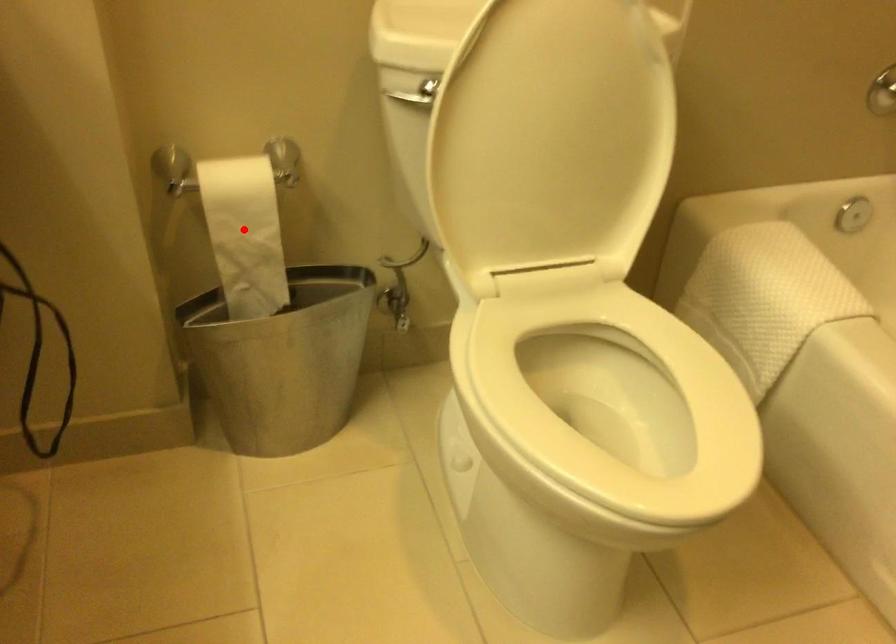
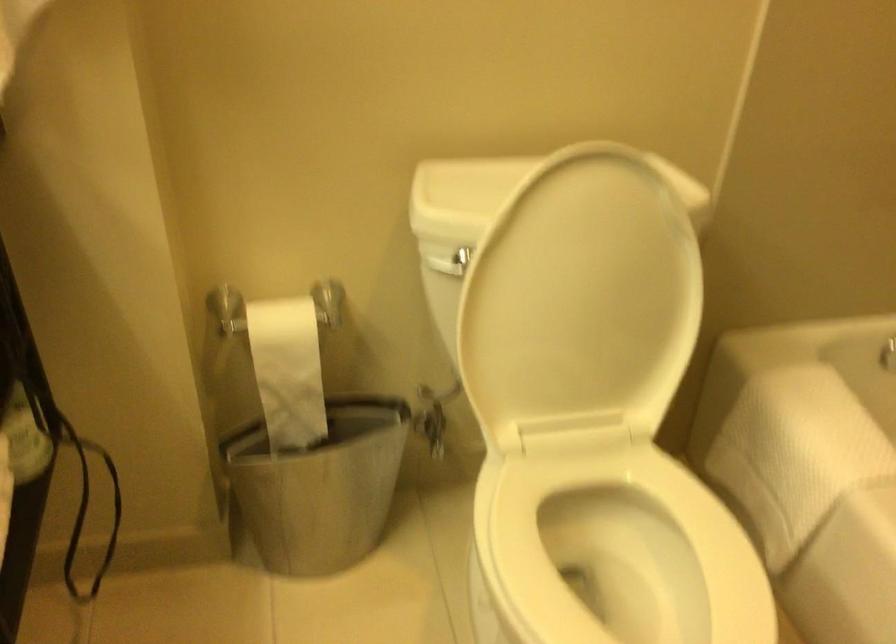
Find the pixel in the second image that matches the highlighted location in the first image.

(288, 370)